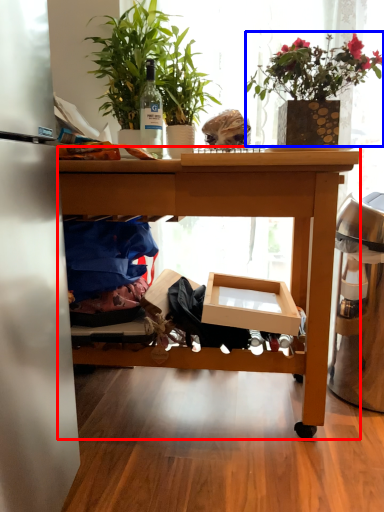
Question: Which object appears closest to the camera in this image, desk (highlighted by a red box) or houseplant (highlighted by a blue box)?

Choices:
 (A) desk
 (B) houseplant

Answer: (A)